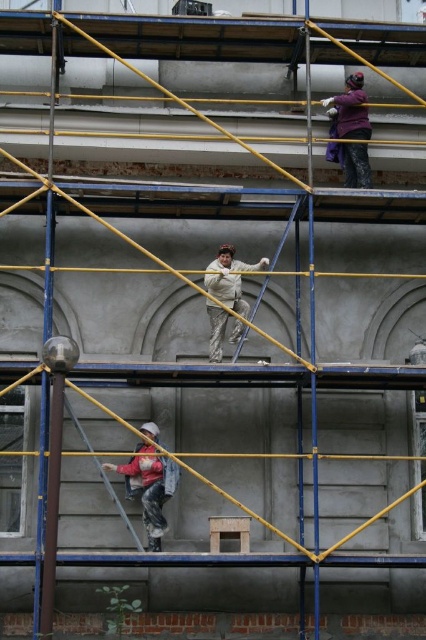
Question: Which object is positioned farthest from the white matte ladder at center?

Choices:
 (A) metallic silver ladder at lower center
 (B) denim jacket at lower center
 (C) purple matte shirt at upper center
 (D) white matte jumpsuit at center

Answer: (C)

Question: Which of the following is the farthest from the observer?

Choices:
 (A) (281, 243)
 (B) (149, 474)
 (C) (238, 294)
 (D) (345, 131)

Answer: (D)

Question: Where is white matte jumpsuit at center located in relation to metallic silver ladder at lower center in the image?

Choices:
 (A) left
 (B) right

Answer: (B)

Question: Is white matte jumpsuit at center wider than metallic silver ladder at lower center?

Choices:
 (A) yes
 (B) no

Answer: (A)

Question: Which point is farther from the camera taking this photo?

Choices:
 (A) coord(210,332)
 (B) coord(344,100)
 (C) coord(80,426)

Answer: (B)

Question: Does denim jacket at lower center appear over white matte ladder at center?

Choices:
 (A) no
 (B) yes

Answer: (A)